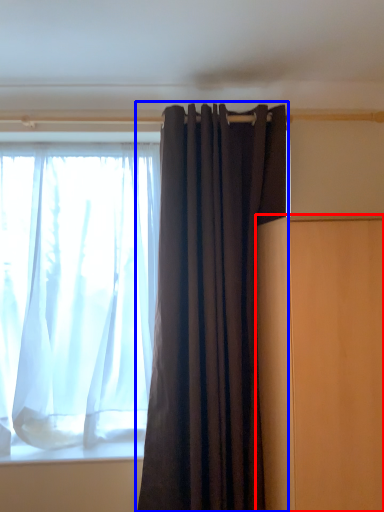
Question: Which object appears farthest to the camera in this image, furniture (highlighted by a red box) or curtain (highlighted by a blue box)?

Choices:
 (A) furniture
 (B) curtain

Answer: (B)